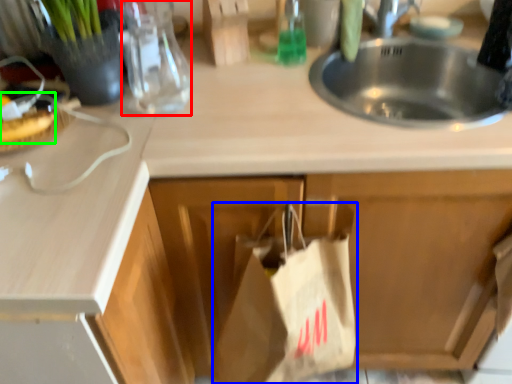
Question: Estimate the real-world distances between objects in this image. Which object is farther from bottle (highlighted by a red box), grocery bag (highlighted by a blue box) or food (highlighted by a green box)?

Choices:
 (A) grocery bag
 (B) food

Answer: (A)